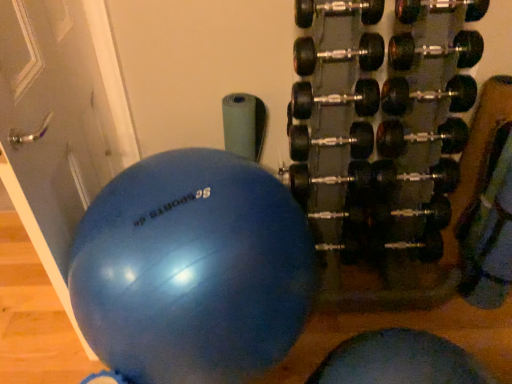
Question: Is matte gray door at left not within blue rubber ball at center?

Choices:
 (A) no
 (B) yes

Answer: (B)

Question: Considering the relative sizes of matte gray door at left and blue rubber ball at center in the image provided, is matte gray door at left taller than blue rubber ball at center?

Choices:
 (A) yes
 (B) no

Answer: (A)

Question: Considering the relative sizes of matte gray door at left and blue rubber ball at center in the image provided, is matte gray door at left bigger than blue rubber ball at center?

Choices:
 (A) no
 (B) yes

Answer: (A)

Question: From the image's perspective, is matte gray door at left over blue rubber ball at center?

Choices:
 (A) no
 (B) yes

Answer: (B)

Question: Is the position of matte gray door at left more distant than that of blue rubber ball at center?

Choices:
 (A) no
 (B) yes

Answer: (A)

Question: Does matte gray door at left have a greater width compared to blue rubber ball at center?

Choices:
 (A) yes
 (B) no

Answer: (B)

Question: Considering the relative positions of blue rubber ball at center and black rubber dumbbell at right in the image provided, is blue rubber ball at center in front of black rubber dumbbell at right?

Choices:
 (A) yes
 (B) no

Answer: (A)

Question: Considering the relative sizes of blue rubber ball at center and black rubber dumbbell at right in the image provided, is blue rubber ball at center smaller than black rubber dumbbell at right?

Choices:
 (A) no
 (B) yes

Answer: (B)

Question: Is the surface of blue rubber ball at center in direct contact with black rubber dumbbell at right?

Choices:
 (A) yes
 (B) no

Answer: (B)

Question: Does blue rubber ball at center appear on the right side of black rubber dumbbell at right?

Choices:
 (A) no
 (B) yes

Answer: (A)

Question: Is blue rubber ball at center positioned behind black rubber dumbbell at right?

Choices:
 (A) no
 (B) yes

Answer: (A)

Question: Is blue rubber ball at center positioned beyond the bounds of black rubber dumbbell at right?

Choices:
 (A) no
 (B) yes

Answer: (B)

Question: Can you confirm if black rubber dumbbell at right is wider than matte gray door at left?

Choices:
 (A) no
 (B) yes

Answer: (B)